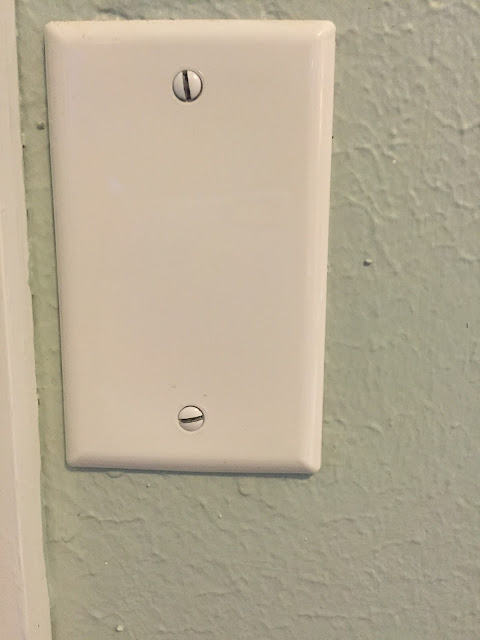
Find the location of a particular element. Image resolution: width=480 pixels, height=640 pixels. paint is located at coordinates (20, 258).